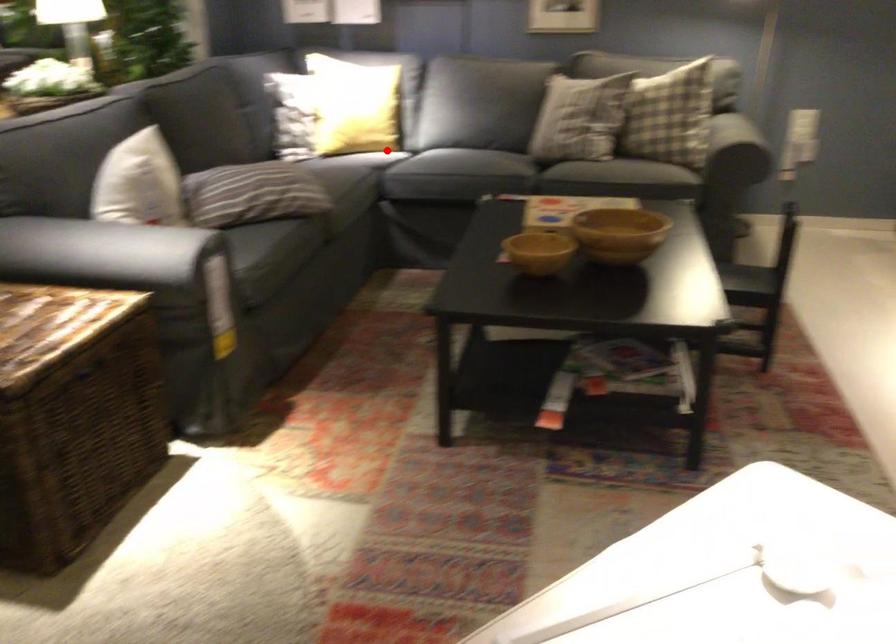
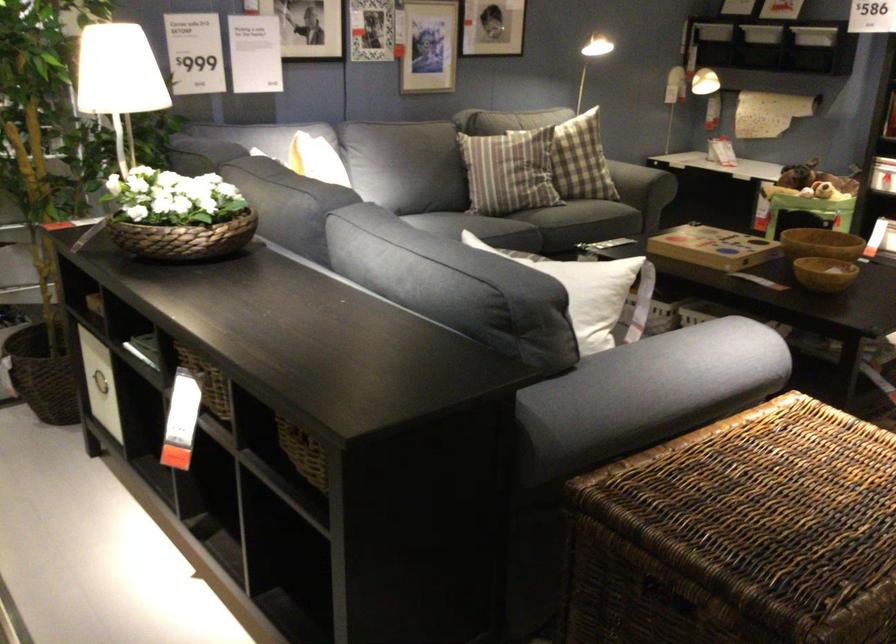
Question: I am providing you with two images of the same scene from different viewpoints. A red point is marked on the first image. At the location where the point appears in image 1, is it still visible in image 2?

Choices:
 (A) Yes
 (B) No

Answer: (B)